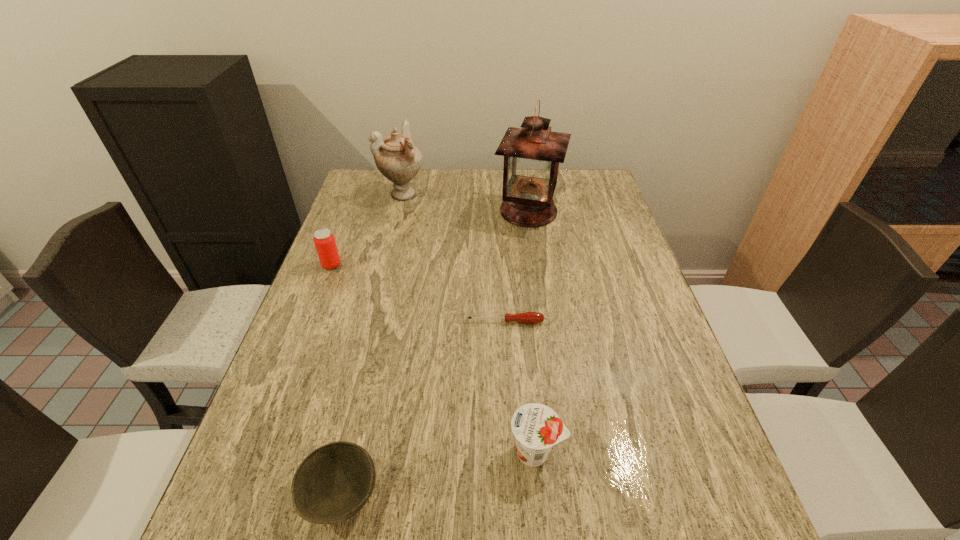
You are a GUI agent. You are given a task and a screenshot of the screen. Output one action in this format:
    pyautogui.click(x=<x>, y=<y>)
    Task: Click on the object situated at the far left corner
    The height and width of the screenshot is (540, 960).
    Given the screenshot: What is the action you would take?
    pyautogui.click(x=396, y=157)

Identify the location of object present at the near left corner. (333, 483).

At what (x,y) coordinates should I click in order to perform the action: click on vacant space at the far edge of the desktop. Please return your answer as a coordinate pair (x, y). The image size is (960, 540). Looking at the image, I should click on (415, 180).

Identify the location of free location at the right edge of the desktop. (682, 423).

In the image, there is a desktop. At what (x,y) coordinates should I click in order to perform the action: click on vacant space at the far left corner. Please return your answer as a coordinate pair (x, y). Image resolution: width=960 pixels, height=540 pixels. Looking at the image, I should click on (357, 177).

Where is `free space at the near right corner of the desktop`? Image resolution: width=960 pixels, height=540 pixels. free space at the near right corner of the desktop is located at coordinates (669, 536).

The width and height of the screenshot is (960, 540). In order to click on vacant area that lies between the tallest object and the fifth tallest object in this screenshot , I will do `click(435, 353)`.

I want to click on free space between the third farthest object and the urn, so click(367, 230).

Identify the location of vacant space that is in between the fourth farthest object and the leftmost object. (419, 293).

You are a GUI agent. You are given a task and a screenshot of the screen. Output one action in this format:
    pyautogui.click(x=<x>, y=<y>)
    Task: Click on the vacant region between the tallest object and the shortest object
    The width and height of the screenshot is (960, 540).
    Given the screenshot: What is the action you would take?
    pyautogui.click(x=516, y=266)